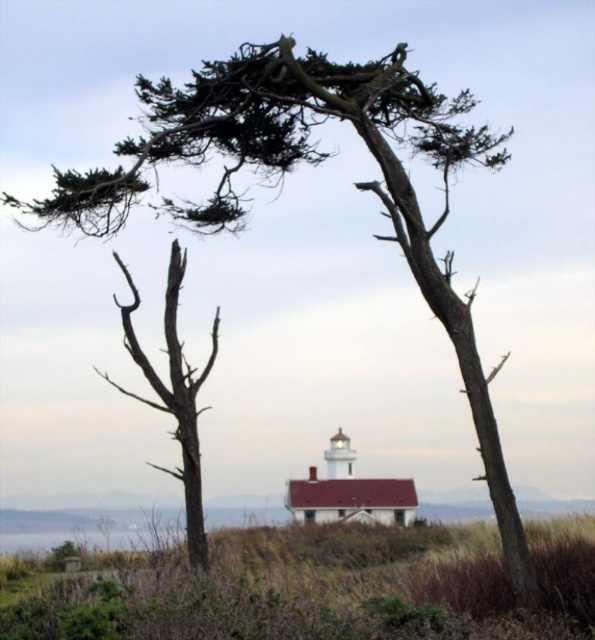
Is bare wood tree at left to the right of transparent water at lower left from the viewer's perspective?

Indeed, bare wood tree at left is positioned on the right side of transparent water at lower left.

In the scene shown: Can you confirm if bare wood tree at left is positioned to the left of transparent water at lower left?

In fact, bare wood tree at left is to the right of transparent water at lower left.

The width and height of the screenshot is (595, 640). What do you see at coordinates (173, 396) in the screenshot?
I see `bare wood tree at left` at bounding box center [173, 396].

At what (x,y) coordinates should I click in order to perform the action: click on bare wood tree at left. Please return your answer as a coordinate pair (x, y). This screenshot has height=640, width=595. Looking at the image, I should click on (173, 396).